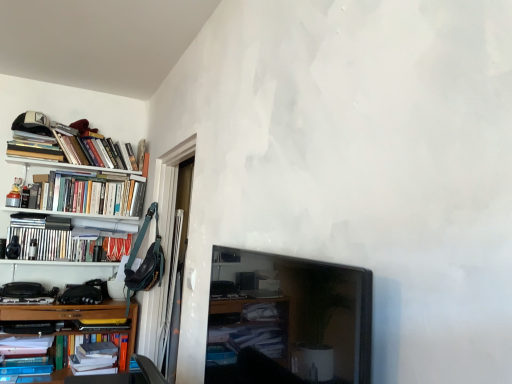
Question: Considering the relative sizes of hardcover books at upper left, the sixth book positioned from the bottom, and hardcover books at left, the first book in the top-to-bottom sequence, in the image provided, is hardcover books at upper left, the sixth book positioned from the bottom, taller than hardcover books at left, the first book in the top-to-bottom sequence,?

Choices:
 (A) yes
 (B) no

Answer: (A)

Question: Does hardcover books at upper left, the sixth book positioned from the bottom, lie behind hardcover books at left, which appears as the seventh book when ordered from the bottom?

Choices:
 (A) yes
 (B) no

Answer: (A)

Question: Considering the relative positions of hardcover books at upper left, marked as the 2th book in a top-to-bottom arrangement, and hardcover books at left, which appears as the seventh book when ordered from the bottom, in the image provided, is hardcover books at upper left, marked as the 2th book in a top-to-bottom arrangement, to the right of hardcover books at left, which appears as the seventh book when ordered from the bottom, from the viewer's perspective?

Choices:
 (A) no
 (B) yes

Answer: (B)

Question: Does hardcover books at upper left, marked as the 2th book in a top-to-bottom arrangement, have a lesser height compared to hardcover books at left, the first book in the top-to-bottom sequence?

Choices:
 (A) no
 (B) yes

Answer: (A)

Question: Are hardcover books at upper left, the sixth book positioned from the bottom, and hardcover books at left, which appears as the seventh book when ordered from the bottom, making contact?

Choices:
 (A) yes
 (B) no

Answer: (B)

Question: Considering the positions of hardcover books at left, which is counted as the fifth book, starting from the bottom, and hardcover books at left, marked as the 5th book in a top-to-bottom arrangement, in the image, is hardcover books at left, which is counted as the fifth book, starting from the bottom, taller or shorter than hardcover books at left, marked as the 5th book in a top-to-bottom arrangement,?

Choices:
 (A) tall
 (B) short

Answer: (B)

Question: From a real-world perspective, is hardcover books at left, the third book in the top-to-bottom sequence, positioned above or below hardcover books at left, marked as the 5th book in a top-to-bottom arrangement?

Choices:
 (A) below
 (B) above

Answer: (B)

Question: From the image's perspective, is hardcover books at left, which is counted as the fifth book, starting from the bottom, above or below hardcover books at left, marked as the 5th book in a top-to-bottom arrangement?

Choices:
 (A) below
 (B) above

Answer: (B)

Question: Considering the positions of point (55, 178) and point (38, 365), is point (55, 178) closer or farther from the camera than point (38, 365)?

Choices:
 (A) closer
 (B) farther

Answer: (B)

Question: From a real-world perspective, is hardcover book at lower left, placed as the 7th book when sorted from top to bottom, positioned above or below hardcover books at left, which appears as the fourth book when ordered from the bottom?

Choices:
 (A) below
 (B) above

Answer: (A)

Question: Is hardcover book at lower left, the 1th book in the bottom-to-top sequence, taller or shorter than hardcover books at left, which is the fourth book from top to bottom?

Choices:
 (A) short
 (B) tall

Answer: (A)

Question: Does point (103, 364) appear closer or farther from the camera than point (37, 241)?

Choices:
 (A) closer
 (B) farther

Answer: (A)

Question: Would you say hardcover book at lower left, the 1th book in the bottom-to-top sequence, is to the left or to the right of hardcover books at left, which appears as the fourth book when ordered from the bottom, in the picture?

Choices:
 (A) right
 (B) left

Answer: (A)

Question: From the image's perspective, is hardcover books at left, which appears as the seventh book when ordered from the bottom, located above or below matte black tv at center?

Choices:
 (A) above
 (B) below

Answer: (A)

Question: Visually, is hardcover books at left, the first book in the top-to-bottom sequence, positioned to the left or to the right of matte black tv at center?

Choices:
 (A) right
 (B) left

Answer: (B)